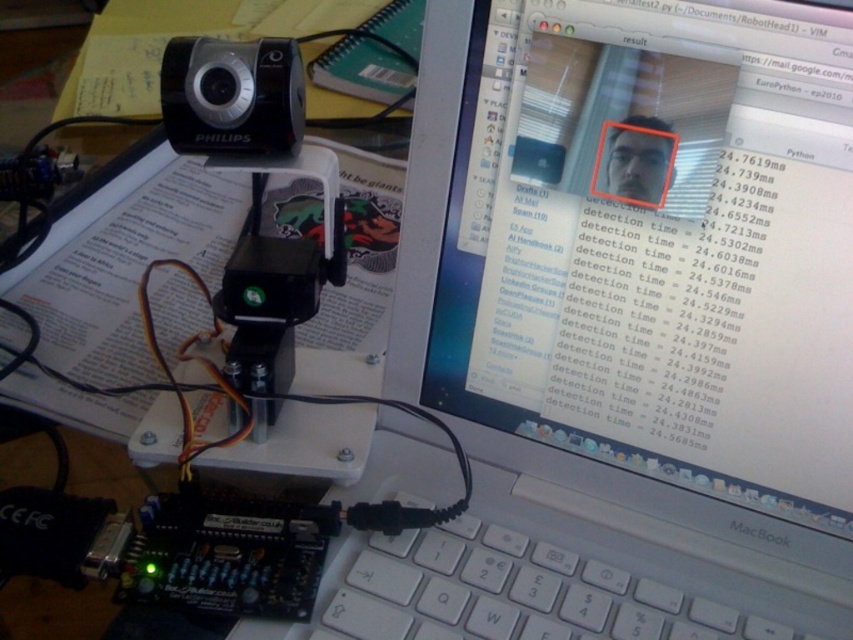
Can you confirm if matte black monitor at upper center is positioned to the left of black plastic camera at upper left?

Incorrect, matte black monitor at upper center is not on the left side of black plastic camera at upper left.

Is matte black monitor at upper center bigger than black plastic camera at upper left?

Yes, matte black monitor at upper center is bigger than black plastic camera at upper left.

Identify the location of matte black monitor at upper center. The image size is (853, 640). (654, 250).

I want to click on white plastic keyboard at lower center, so click(x=511, y=593).

Is white plastic keyboard at lower center shorter than black plastic camera at upper left?

Yes.

This screenshot has width=853, height=640. Find the location of `white plastic keyboard at lower center`. white plastic keyboard at lower center is located at coordinates click(511, 593).

Is point (721, 67) positioned behind point (550, 636)?

No, it is in front of (550, 636).

Is matte black monitor at upper center further to camera compared to white plastic keyboard at lower center?

No.

Who is more distant from viewer, (773, 218) or (469, 536)?

The point (469, 536) is more distant.

Where is `matte black monitor at upper center`? The image size is (853, 640). matte black monitor at upper center is located at coordinates (654, 250).